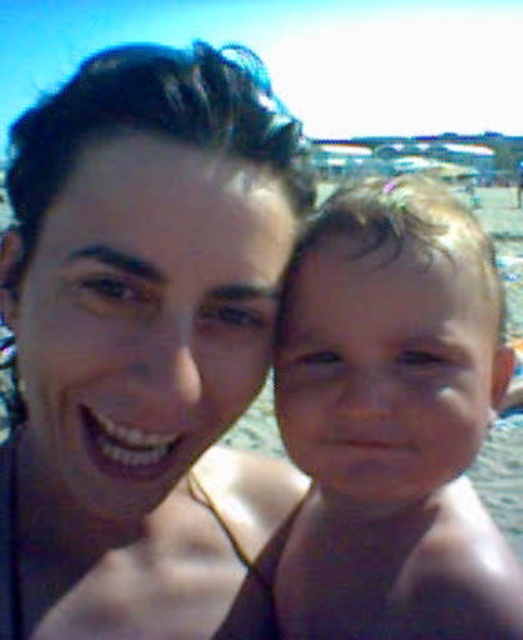
Is matte black hair at center to the right of clear blue water at baby right from the viewer's perspective?

Incorrect, matte black hair at center is not on the right side of clear blue water at baby right.

Between matte black hair at center and clear blue water at baby right, which one is positioned lower?

matte black hair at center is below.

Image resolution: width=523 pixels, height=640 pixels. Identify the location of matte black hair at center. (142, 340).

Does matte black hair at center have a greater height compared to smooth skin baby at center?

Yes.

Between point (247, 106) and point (333, 296), which one is positioned behind?

The point (333, 296) is behind.

The width and height of the screenshot is (523, 640). What are the coordinates of `matte black hair at center` in the screenshot? It's located at (142, 340).

Measure the distance between smooth skin baby at center and clear blue water at baby right.

They are 4.97 feet apart.

Is point (445, 628) positioned in front of point (507, 426)?

That is True.

This screenshot has width=523, height=640. Identify the location of smooth skin baby at center. (392, 420).

The height and width of the screenshot is (640, 523). In order to click on smooth skin baby at center in this screenshot , I will do `click(392, 420)`.